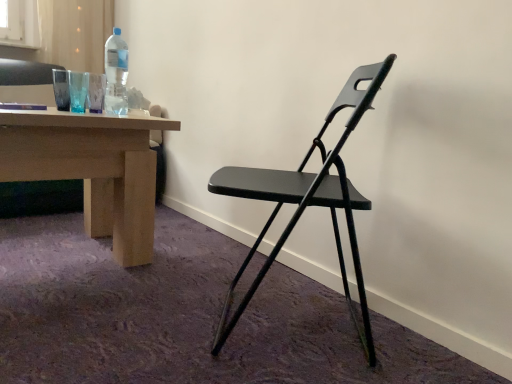
Question: Does matte black folding chair at center have a smaller size compared to transparent plastic bottle at upper left?

Choices:
 (A) yes
 (B) no

Answer: (B)

Question: Can you confirm if matte black folding chair at center is thinner than transparent plastic bottle at upper left?

Choices:
 (A) yes
 (B) no

Answer: (B)

Question: Is matte black folding chair at center far from transparent plastic bottle at upper left?

Choices:
 (A) no
 (B) yes

Answer: (A)

Question: From the image's perspective, does matte black folding chair at center appear higher than transparent plastic bottle at upper left?

Choices:
 (A) yes
 (B) no

Answer: (B)

Question: Is matte black folding chair at center surrounding transparent plastic bottle at upper left?

Choices:
 (A) yes
 (B) no

Answer: (B)

Question: Is the position of matte black folding chair at center less distant than that of transparent plastic bottle at upper left?

Choices:
 (A) yes
 (B) no

Answer: (A)

Question: Considering the relative sizes of transparent plastic bottle at upper left and matte black folding chair at center in the image provided, is transparent plastic bottle at upper left shorter than matte black folding chair at center?

Choices:
 (A) yes
 (B) no

Answer: (A)

Question: Are transparent plastic bottle at upper left and matte black folding chair at center making contact?

Choices:
 (A) yes
 (B) no

Answer: (B)

Question: From the image's perspective, is transparent plastic bottle at upper left under matte black folding chair at center?

Choices:
 (A) yes
 (B) no

Answer: (B)

Question: Is transparent plastic bottle at upper left not within matte black folding chair at center?

Choices:
 (A) yes
 (B) no

Answer: (A)

Question: Does transparent plastic bottle at upper left have a lesser width compared to matte black folding chair at center?

Choices:
 (A) yes
 (B) no

Answer: (A)

Question: Is transparent plastic bottle at upper left behind matte black folding chair at center?

Choices:
 (A) no
 (B) yes

Answer: (B)

Question: From the image's perspective, is matte black folding chair at center above or below transparent plastic bottle at upper left?

Choices:
 (A) above
 (B) below

Answer: (B)